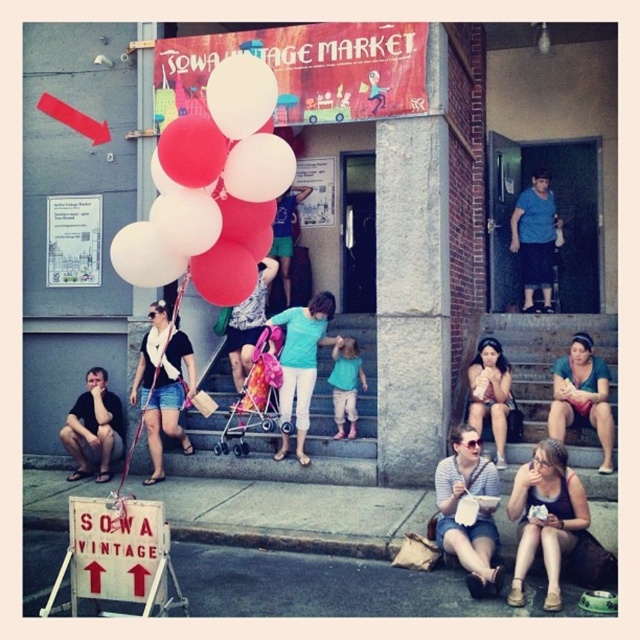
Between matte teal shirt at center and blue cotton shirt at upper center, which one has more height?

blue cotton shirt at upper center

Which is behind, point (326, 296) or point (550, 240)?

The point (550, 240) is behind.

Is point (312, 355) positioned in front of point (532, 253)?

Yes, point (312, 355) is in front of point (532, 253).

I want to click on matte teal shirt at center, so click(301, 358).

Does matte white balloons at center have a greater width compared to striped cotton shirt at lower right?

Indeed, matte white balloons at center has a greater width compared to striped cotton shirt at lower right.

Is matte white balloons at center positioned in front of striped cotton shirt at lower right?

Yes, matte white balloons at center is in front of striped cotton shirt at lower right.

Between point (170, 136) and point (490, 516), which one is positioned behind?

Point (490, 516)

This screenshot has width=640, height=640. What are the coordinates of `matte white balloons at center` in the screenshot? It's located at (212, 189).

Which is above, matte white scarf at center or matte black baguette at center?

matte white scarf at center is higher up.

You are a GUI agent. You are given a task and a screenshot of the screen. Output one action in this format:
    pyautogui.click(x=<x>, y=<y>)
    Task: Click on the matte white scarf at center
    
    Given the screenshot: What is the action you would take?
    pyautogui.click(x=163, y=384)